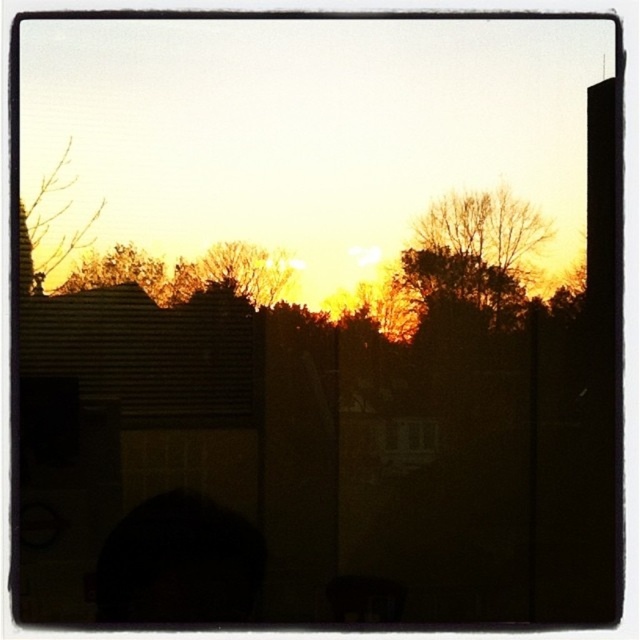
Question: Observing the image, what is the correct spatial positioning of orange-brown textured tree at center in reference to brown textured tree at upper left?

Choices:
 (A) right
 (B) left

Answer: (A)

Question: Considering the relative positions of bare branches at upper left and brown textured tree at upper left in the image provided, where is bare branches at upper left located with respect to brown textured tree at upper left?

Choices:
 (A) above
 (B) below

Answer: (A)

Question: Does bare branches at upper left have a greater width compared to brown textured tree at upper left?

Choices:
 (A) yes
 (B) no

Answer: (B)

Question: Which point is closer to the camera taking this photo?

Choices:
 (A) (45, 234)
 (B) (129, 269)
 (C) (257, 301)

Answer: (A)

Question: Considering the real-world distances, which object is farthest from the brown textured tree at upper left?

Choices:
 (A) orange-brown textured tree at center
 (B) bare branches at upper left

Answer: (A)

Question: Which object is farther from the camera taking this photo?

Choices:
 (A) orange-brown textured tree at center
 (B) brown textured tree at upper left

Answer: (A)